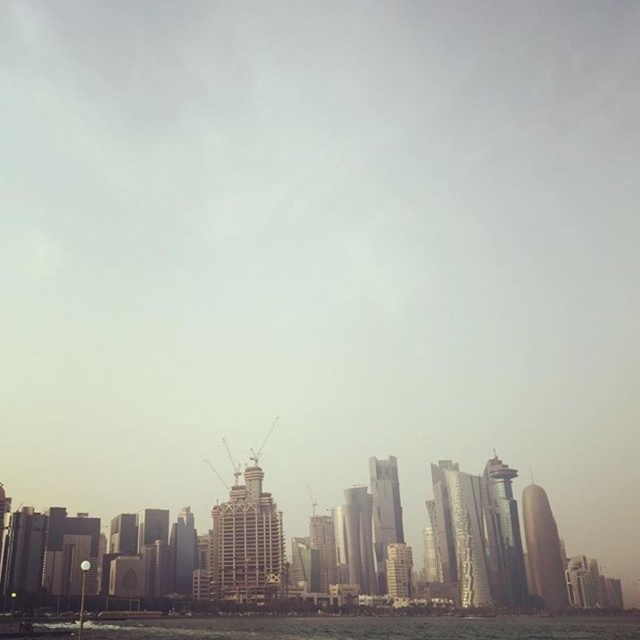
Between point (268, 556) and point (364, 572), which one is positioned behind?

Point (364, 572)

Between metallic glass skyscraper at center and shiny metallic skyscraper at center, which one appears on the right side from the viewer's perspective?

shiny metallic skyscraper at center is more to the right.

Locate an element on the screen. Image resolution: width=640 pixels, height=640 pixels. metallic glass skyscraper at center is located at coordinates (246, 541).

Image resolution: width=640 pixels, height=640 pixels. What do you see at coordinates (371, 627) in the screenshot?
I see `green water at lower center` at bounding box center [371, 627].

Identify the location of green water at lower center. (371, 627).

Does point (448, 632) come farther from viewer compared to point (257, 561)?

Yes, point (448, 632) is farther from viewer.

Where is `green water at lower center`? This screenshot has width=640, height=640. green water at lower center is located at coordinates [x=371, y=627].

Is green water at lower center to the right of gold metallic tower at right from the viewer's perspective?

In fact, green water at lower center is to the left of gold metallic tower at right.

What do you see at coordinates (371, 627) in the screenshot? The image size is (640, 640). I see `green water at lower center` at bounding box center [371, 627].

I want to click on green water at lower center, so click(371, 627).